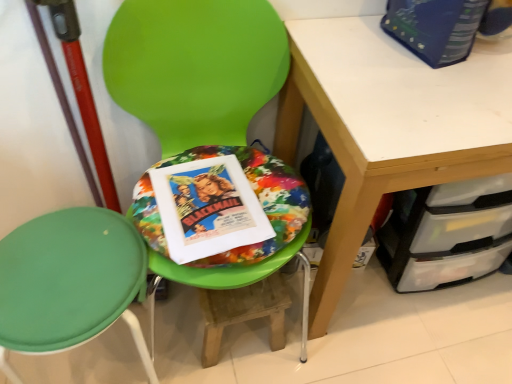
This screenshot has width=512, height=384. I want to click on free space in front of blue cardboard book at upper right, the first paperback book positioned from the right, so click(433, 86).